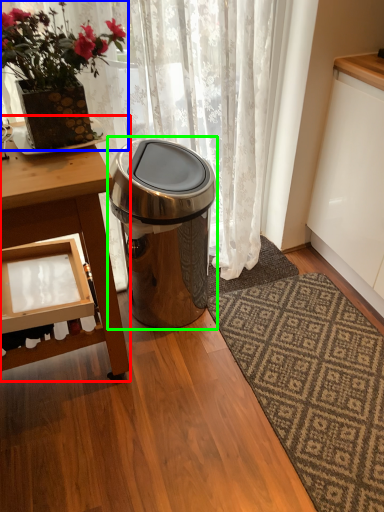
Question: Which object is positioned farthest from table (highlighted by a red box)? Select from houseplant (highlighted by a blue box) and trash bin/can (highlighted by a green box).

Choices:
 (A) houseplant
 (B) trash bin/can

Answer: (B)